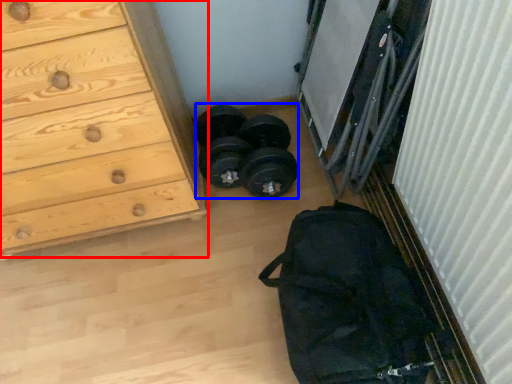
Question: Which point is further to the camera, chest of drawers (highlighted by a red box) or reel (highlighted by a blue box)?

Choices:
 (A) chest of drawers
 (B) reel

Answer: (B)